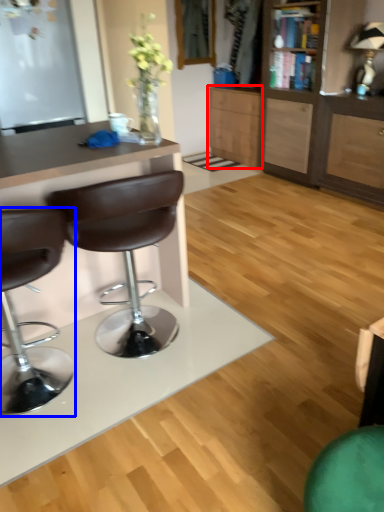
Question: Among these objects, which one is farthest to the camera, cabinetry (highlighted by a red box) or chair (highlighted by a blue box)?

Choices:
 (A) cabinetry
 (B) chair

Answer: (A)